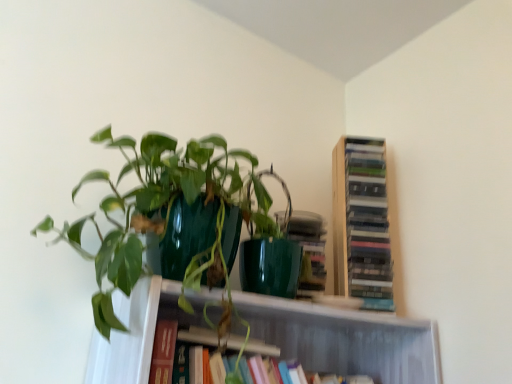
Question: Is wooden bookshelf at upper right, the first book positioned from the top, not within green glossy pot at upper left?

Choices:
 (A) no
 (B) yes

Answer: (B)

Question: From the image's perspective, is wooden bookshelf at upper right, the 2th book positioned from the bottom, on top of green glossy pot at upper left?

Choices:
 (A) no
 (B) yes

Answer: (B)

Question: Can you confirm if wooden bookshelf at upper right, the first book positioned from the top, is taller than green glossy pot at upper left?

Choices:
 (A) yes
 (B) no

Answer: (A)

Question: Is wooden bookshelf at upper right, the first book positioned from the top, with green glossy pot at upper left?

Choices:
 (A) no
 (B) yes

Answer: (A)

Question: Can you confirm if wooden bookshelf at upper right, the first book positioned from the top, is wider than green glossy pot at upper left?

Choices:
 (A) no
 (B) yes

Answer: (A)

Question: Is green glossy pot at upper left bigger or smaller than wooden bookshelf at upper right, the first book positioned from the top?

Choices:
 (A) small
 (B) big

Answer: (B)

Question: Does point (97, 321) appear closer or farther from the camera than point (345, 263)?

Choices:
 (A) closer
 (B) farther

Answer: (A)

Question: Considering the positions of green glossy pot at upper left and wooden bookshelf at upper right, the first book positioned from the top, in the image, is green glossy pot at upper left wider or thinner than wooden bookshelf at upper right, the first book positioned from the top,?

Choices:
 (A) wide
 (B) thin

Answer: (A)

Question: Visually, is green glossy pot at upper left positioned to the left or to the right of wooden bookshelf at upper right, the 2th book positioned from the bottom?

Choices:
 (A) right
 (B) left

Answer: (B)

Question: From the image's perspective, is hardcover book at center, which is the second book in top-to-bottom order, above or below green glossy pot at upper left?

Choices:
 (A) below
 (B) above

Answer: (A)

Question: From a real-world perspective, is hardcover book at center, which is the second book in top-to-bottom order, physically located above or below green glossy pot at upper left?

Choices:
 (A) below
 (B) above

Answer: (A)

Question: Is hardcover book at center, which is the second book in top-to-bottom order, spatially inside green glossy pot at upper left, or outside of it?

Choices:
 (A) inside
 (B) outside

Answer: (B)

Question: Relative to green glossy pot at upper left, is hardcover book at center, the 1th book ordered from the bottom, in front or behind?

Choices:
 (A) behind
 (B) front

Answer: (A)

Question: Considering the relative positions of hardcover book at center, which is the second book in top-to-bottom order, and wooden bookshelf at upper right, the first book positioned from the top, in the image provided, is hardcover book at center, which is the second book in top-to-bottom order, to the left or to the right of wooden bookshelf at upper right, the first book positioned from the top,?

Choices:
 (A) right
 (B) left

Answer: (B)

Question: From a real-world perspective, is hardcover book at center, which is the second book in top-to-bottom order, positioned above or below wooden bookshelf at upper right, the first book positioned from the top?

Choices:
 (A) below
 (B) above

Answer: (A)